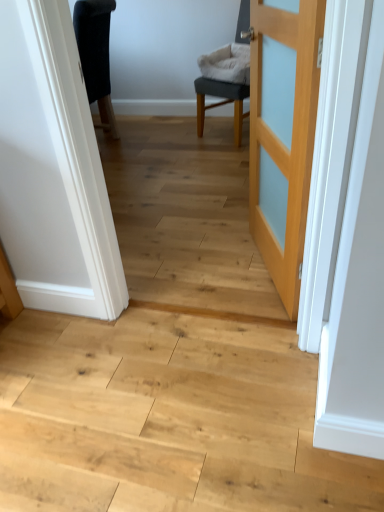
The height and width of the screenshot is (512, 384). What are the coordinates of `vacant space in front of gray fabric chair at center` in the screenshot? It's located at (219, 158).